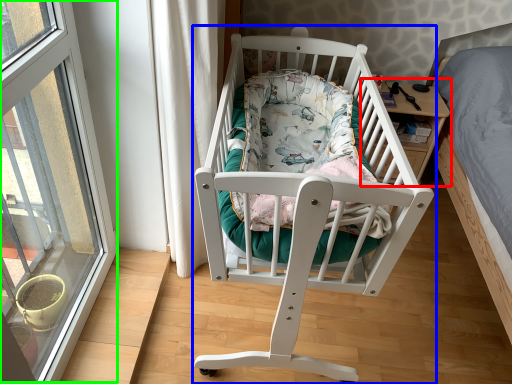
Question: Considering the real-world distances, which object is closest to table (highlighted by a red box)? infant bed (highlighted by a blue box) or window (highlighted by a green box).

Choices:
 (A) infant bed
 (B) window

Answer: (A)